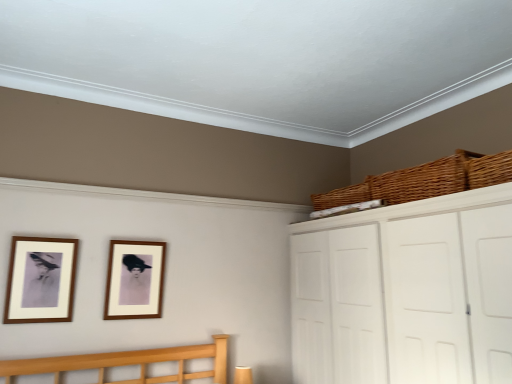
Question: Can you confirm if white matte cabinet at upper right is shorter than wooden picture frame at center, marked as the second picture frame in a left-to-right arrangement?

Choices:
 (A) no
 (B) yes

Answer: (A)

Question: Can you confirm if white matte cabinet at upper right is wider than wooden picture frame at center, the first picture frame positioned from the back?

Choices:
 (A) yes
 (B) no

Answer: (A)

Question: From a real-world perspective, is white matte cabinet at upper right located beneath wooden picture frame at center, the second picture frame positioned from the front?

Choices:
 (A) yes
 (B) no

Answer: (A)

Question: From a real-world perspective, is white matte cabinet at upper right over wooden picture frame at center, positioned as the 1th picture frame in right-to-left order?

Choices:
 (A) yes
 (B) no

Answer: (B)

Question: Is white matte cabinet at upper right completely or partially outside of wooden picture frame at center, positioned as the 1th picture frame in right-to-left order?

Choices:
 (A) no
 (B) yes

Answer: (B)

Question: Can you confirm if white matte cabinet at upper right is smaller than wooden picture frame at center, the first picture frame positioned from the back?

Choices:
 (A) yes
 (B) no

Answer: (B)

Question: Considering the relative sizes of woven brown basket at upper right, acting as the third basket starting from the back, and wooden picture frame at center, positioned as the 1th picture frame in right-to-left order, in the image provided, is woven brown basket at upper right, acting as the third basket starting from the back, smaller than wooden picture frame at center, positioned as the 1th picture frame in right-to-left order,?

Choices:
 (A) no
 (B) yes

Answer: (A)

Question: Does woven brown basket at upper right, placed as the 1th basket when sorted from front to back, have a greater height compared to wooden picture frame at center, marked as the second picture frame in a left-to-right arrangement?

Choices:
 (A) yes
 (B) no

Answer: (B)

Question: From the image's perspective, is woven brown basket at upper right, acting as the third basket starting from the back, over wooden picture frame at center, positioned as the 1th picture frame in right-to-left order?

Choices:
 (A) yes
 (B) no

Answer: (A)

Question: Is the depth of woven brown basket at upper right, placed as the 1th basket when sorted from front to back, greater than that of wooden picture frame at center, marked as the second picture frame in a left-to-right arrangement?

Choices:
 (A) no
 (B) yes

Answer: (A)

Question: From the image's perspective, is woven brown basket at upper right, placed as the 1th basket when sorted from front to back, located beneath wooden picture frame at center, the second picture frame positioned from the front?

Choices:
 (A) yes
 (B) no

Answer: (B)

Question: Are woven brown basket at upper right, acting as the third basket starting from the back, and wooden picture frame at center, the first picture frame positioned from the back, making contact?

Choices:
 (A) yes
 (B) no

Answer: (B)

Question: Considering the relative positions of woven brown basket at upper right, marked as the 1th basket in a back-to-front arrangement, and woven brown basket at upper right, arranged as the second basket when viewed from the front, in the image provided, is woven brown basket at upper right, marked as the 1th basket in a back-to-front arrangement, to the right of woven brown basket at upper right, arranged as the second basket when viewed from the front, from the viewer's perspective?

Choices:
 (A) no
 (B) yes

Answer: (A)